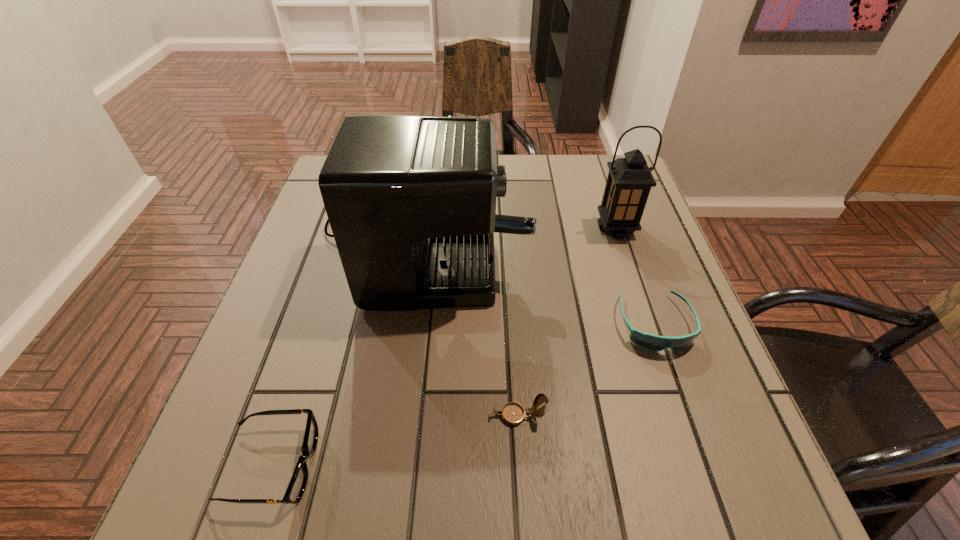
This screenshot has height=540, width=960. I want to click on free area in between the fourth shortest object and the nearer sunglasses, so click(444, 347).

Locate an element on the screen. free space that is in between the lantern and the nearer sunglasses is located at coordinates (444, 347).

Point out which object is positioned as the third nearest to the nearer sunglasses. Please provide its 2D coordinates. Your answer should be formatted as a tuple, i.e. [(x, y)], where the tuple contains the x and y coordinates of a point satisfying the conditions above.

[(648, 341)]

What are the coordinates of `object that is the second closest to the coffee maker` in the screenshot? It's located at (629, 181).

Identify the location of free region that satisfies the following two spatial constraints: 1. on the front-facing side of the coffee maker; 2. on the left side of the second tallest object. (425, 228).

Locate an element on the screen. vacant space that satisfies the following two spatial constraints: 1. on the front-facing side of the tallest object; 2. on the back side of the fourth shortest object is located at coordinates pos(425,228).

The height and width of the screenshot is (540, 960). In order to click on free space that satisfies the following two spatial constraints: 1. on the front-facing side of the second tallest object; 2. on the left side of the coffee maker in this screenshot , I will do `click(425, 228)`.

Identify the location of vacant space that satisfies the following two spatial constraints: 1. on the front-facing side of the tallest object; 2. on the left side of the lantern. (425, 228).